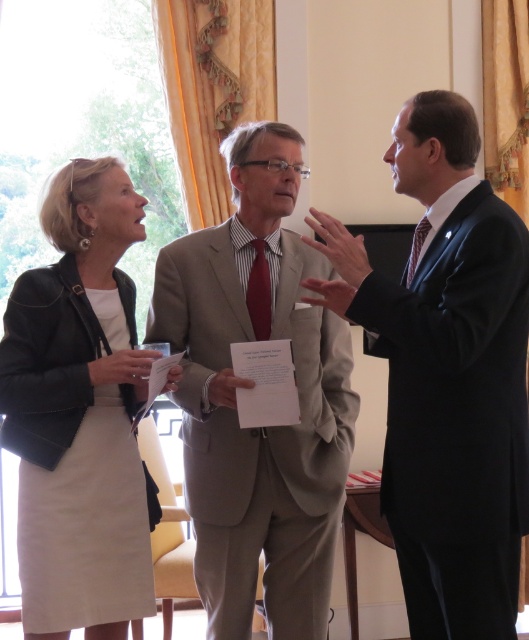
You are a photographer standing 20 inches away from the dark blue suit at right and light beige suit at center. You want to take a photo of both suits in the same frame. Can you position yourself so that both suits are within the camera frame without moving them?

The dark blue suit at right is 16.21 inches away from the light beige suit at center. Since you are standing 20 inches away from both suits, the distance between them is less than your camera range. Therefore, you can position yourself so that both suits are within the camera frame without moving them.

You are standing in the room and want to touch the point at coordinate (446,374). Which person are you likely to reach?

The point at coordinate (446,374) is on the dark blue suit at right, so you would reach the person wearing the dark blue suit on the right.